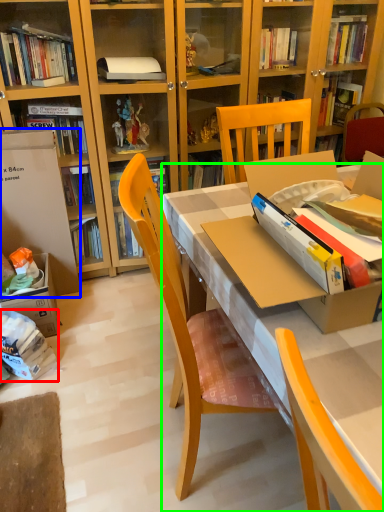
Question: Considering the real-world distances, which object is closest to book (highlighted by a red box)? leftover (highlighted by a blue box) or desk (highlighted by a green box).

Choices:
 (A) leftover
 (B) desk

Answer: (A)